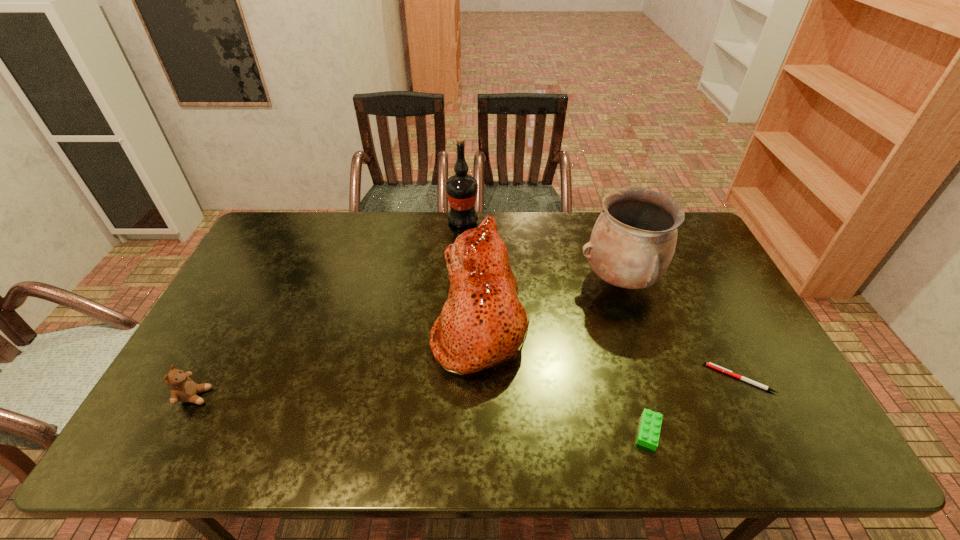
At what (x,y) coordinates should I click in order to perform the action: click on wine bottle. Please return your answer as a coordinate pair (x, y). Image resolution: width=960 pixels, height=540 pixels. Looking at the image, I should click on (461, 189).

Find the location of a particular element. The width and height of the screenshot is (960, 540). urn is located at coordinates (632, 243).

This screenshot has width=960, height=540. What are the coordinates of `cat` in the screenshot? It's located at (482, 323).

Where is `the third shortest object`? The width and height of the screenshot is (960, 540). the third shortest object is located at coordinates (183, 389).

Locate an element on the screen. This screenshot has width=960, height=540. the leftmost object is located at coordinates (183, 389).

The width and height of the screenshot is (960, 540). Find the location of `Lego`. Lego is located at coordinates (649, 431).

In order to click on the nearest object in this screenshot , I will do `click(649, 431)`.

Find the location of a particular element. the shortest object is located at coordinates (709, 364).

The image size is (960, 540). I want to click on pen, so click(709, 364).

At what (x,y) coordinates should I click in order to perform the action: click on vacant space situated 0.320m on the right of the wine bottle. Please return your answer as a coordinate pair (x, y). This screenshot has width=960, height=540. Looking at the image, I should click on (564, 221).